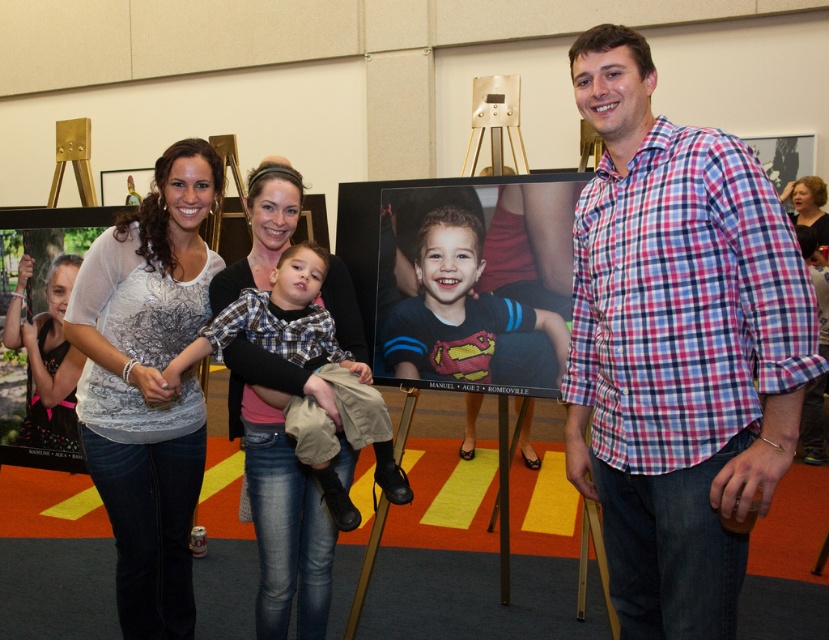
Question: Can you confirm if pink plaid shirt at right is wider than white lace shirt at center?

Choices:
 (A) no
 (B) yes

Answer: (A)

Question: Which point appears farthest from the camera in this image?

Choices:
 (A) (115, 371)
 (B) (721, 582)

Answer: (A)

Question: Which of these objects is positioned farthest from the pink plaid shirt at right?

Choices:
 (A) plaid fabric shirt at center
 (B) matte black shirt at center
 (C) matte black hair at upper right
 (D) matte plastic photo frame at center

Answer: (C)

Question: Does plaid fabric shirt at center come in front of matte black hair at upper right?

Choices:
 (A) yes
 (B) no

Answer: (A)

Question: Can you confirm if pink plaid shirt at right is positioned to the left of matte plastic photo frame at center?

Choices:
 (A) yes
 (B) no

Answer: (B)

Question: Which object is closer to the camera taking this photo?

Choices:
 (A) matte black shirt at left
 (B) white lace shirt at center
 (C) matte black hair at upper right
 (D) matte black shirt at center

Answer: (B)